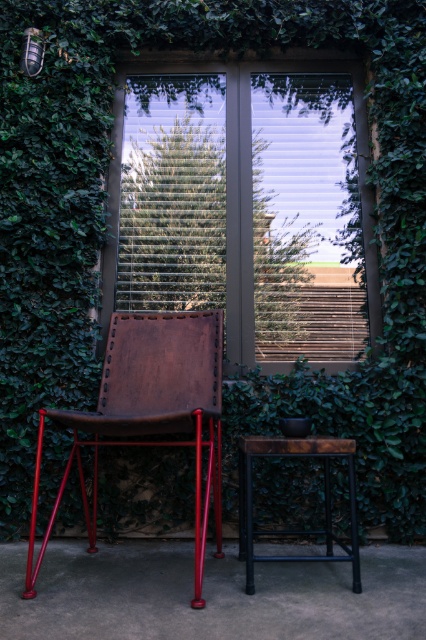
Question: Which of these objects is positioned closest to the matte glass window at center?

Choices:
 (A) leather at left
 (B) rustic wood table at center

Answer: (A)

Question: Which point is farther to the camera?

Choices:
 (A) rustic wood table at center
 (B) leather at left

Answer: (A)

Question: Which of these objects is positioned farthest from the leather at left?

Choices:
 (A) rustic wood table at center
 (B) matte glass window at center

Answer: (B)

Question: Is leather at left to the right of rustic wood table at center from the viewer's perspective?

Choices:
 (A) yes
 (B) no

Answer: (B)

Question: Does matte glass window at center appear under rustic wood table at center?

Choices:
 (A) yes
 (B) no

Answer: (B)

Question: Is leather at left bigger than rustic wood table at center?

Choices:
 (A) no
 (B) yes

Answer: (B)